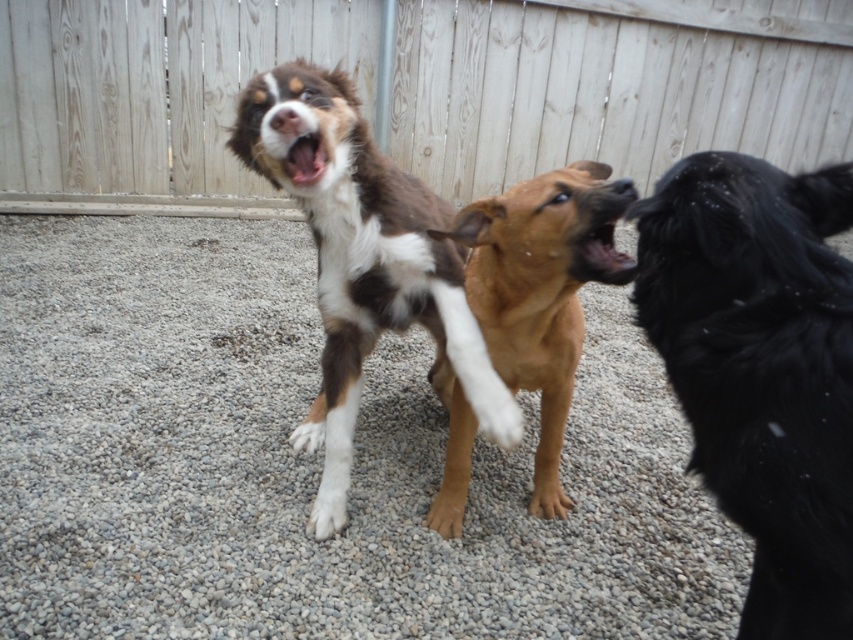
You are a dog owner who wants to clean up after your pet. You notice the gray gravel at center and the white fur paw at lower center. Which object is located to the left side of the other?

The gray gravel at center is to the left of white fur paw at lower center.

You are a dog owner who wants to ensure your new doghouse is tall enough for both the black fluffy dog at right and the white fur at center. Based on the scene, which dog requires a taller doghouse?

The black fluffy dog at right requires a taller doghouse since it has a greater height compared to the white fur at center.